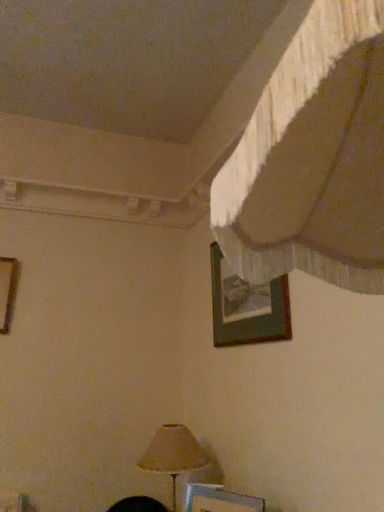
Question: Is wooden picture frame at upper center, which ranks as the third picture frame in bottom-to-top order, facing towards metallic silver picture frame at lower center, which is the 3th picture frame in top-to-bottom order?

Choices:
 (A) no
 (B) yes

Answer: (A)

Question: Is metallic silver picture frame at lower center, the 1th picture frame when ordered from bottom to top, completely or partially inside wooden picture frame at upper center, which is counted as the third picture frame, starting from the left?

Choices:
 (A) yes
 (B) no

Answer: (B)

Question: Is wooden picture frame at upper center, placed as the first picture frame when sorted from right to left, to the right of metallic silver picture frame at lower center, the 1th picture frame when ordered from bottom to top, from the viewer's perspective?

Choices:
 (A) no
 (B) yes

Answer: (B)

Question: From a real-world perspective, is wooden picture frame at upper center, which is the first picture frame from top to bottom, beneath metallic silver picture frame at lower center, the 2th picture frame positioned from the right?

Choices:
 (A) yes
 (B) no

Answer: (B)

Question: Is wooden picture frame at upper center, which ranks as the third picture frame in bottom-to-top order, turned away from metallic silver picture frame at lower center, which is the second picture frame from left to right?

Choices:
 (A) no
 (B) yes

Answer: (A)

Question: From a real-world perspective, is wooden picture frame at upper center, placed as the first picture frame when sorted from right to left, above or below matte beige lampshade at lower center?

Choices:
 (A) above
 (B) below

Answer: (A)

Question: Is wooden picture frame at upper center, which is counted as the third picture frame, starting from the left, wider or thinner than matte beige lampshade at lower center?

Choices:
 (A) thin
 (B) wide

Answer: (A)

Question: In the image, is wooden picture frame at upper center, which is the first picture frame from top to bottom, positioned in front of or behind matte beige lampshade at lower center?

Choices:
 (A) behind
 (B) front

Answer: (B)

Question: Would you say wooden picture frame at upper center, placed as the first picture frame when sorted from right to left, is to the left or to the right of matte beige lampshade at lower center in the picture?

Choices:
 (A) left
 (B) right

Answer: (B)

Question: Is wooden picture frame at upper center, which is counted as the third picture frame, starting from the left, bigger or smaller than metallic silver picture frame at lower center, the 2th picture frame positioned from the right?

Choices:
 (A) small
 (B) big

Answer: (B)

Question: Considering the positions of point (283, 310) and point (188, 482), is point (283, 310) closer or farther from the camera than point (188, 482)?

Choices:
 (A) closer
 (B) farther

Answer: (A)

Question: Is wooden picture frame at upper center, which ranks as the third picture frame in bottom-to-top order, wider or thinner than metallic silver picture frame at lower center, the 2th picture frame positioned from the right?

Choices:
 (A) thin
 (B) wide

Answer: (A)

Question: Relative to metallic silver picture frame at lower center, which is the 3th picture frame in top-to-bottom order, is wooden picture frame at upper center, which is the first picture frame from top to bottom, in front or behind?

Choices:
 (A) behind
 (B) front

Answer: (A)

Question: From the image's perspective, is wooden picture frame at left, which ranks as the first picture frame in left-to-right order, positioned above or below wooden picture frame at upper center, which is counted as the third picture frame, starting from the left?

Choices:
 (A) above
 (B) below

Answer: (B)

Question: Considering the positions of wooden picture frame at left, which is the 2th picture frame in top-to-bottom order, and wooden picture frame at upper center, which is counted as the third picture frame, starting from the left, in the image, is wooden picture frame at left, which is the 2th picture frame in top-to-bottom order, taller or shorter than wooden picture frame at upper center, which is counted as the third picture frame, starting from the left,?

Choices:
 (A) short
 (B) tall

Answer: (A)